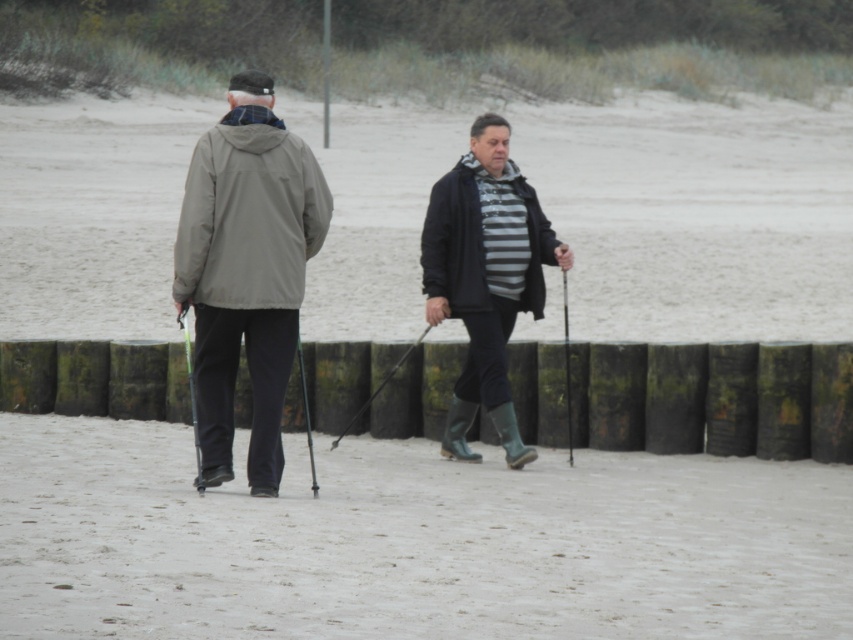
Can you confirm if matte gray jacket at center is wider than green plastic ski pole at left?

Correct, the width of matte gray jacket at center exceeds that of green plastic ski pole at left.

Is matte gray jacket at center positioned at the back of green plastic ski pole at left?

Yes.

Find the location of a particular element. The width and height of the screenshot is (853, 640). matte gray jacket at center is located at coordinates (244, 272).

Does striped fabric shirt at center appear under smooth black ski pole at center?

No, striped fabric shirt at center is not below smooth black ski pole at center.

Is point (486, 141) positioned in front of point (566, 417)?

Yes.

At what (x,y) coordinates should I click in order to perform the action: click on striped fabric shirt at center. Please return your answer as a coordinate pair (x, y). The image size is (853, 640). Looking at the image, I should click on (x=485, y=276).

Does matte gray jacket at left have a greater height compared to metallic black ski pole at center?

Incorrect, matte gray jacket at left's height is not larger of metallic black ski pole at center's.

Does matte gray jacket at left have a lesser height compared to metallic black ski pole at center?

Indeed, matte gray jacket at left has a lesser height compared to metallic black ski pole at center.

You are a GUI agent. You are given a task and a screenshot of the screen. Output one action in this format:
    pyautogui.click(x=<x>, y=<y>)
    Task: Click on the matte gray jacket at left
    Image resolution: width=853 pixels, height=640 pixels.
    Given the screenshot: What is the action you would take?
    pyautogui.click(x=247, y=272)